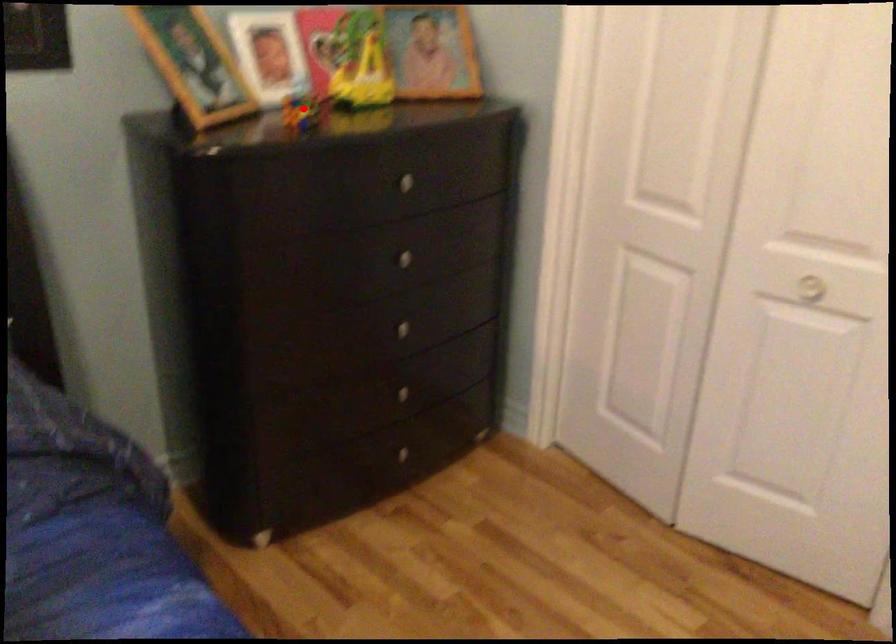
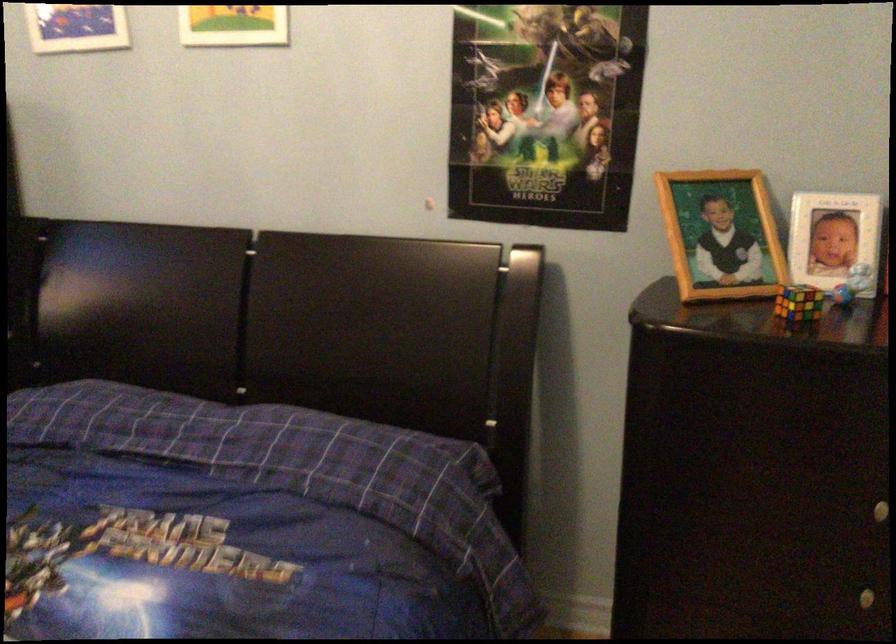
Find the pixel in the second image that matches the highlighted location in the first image.

(798, 303)